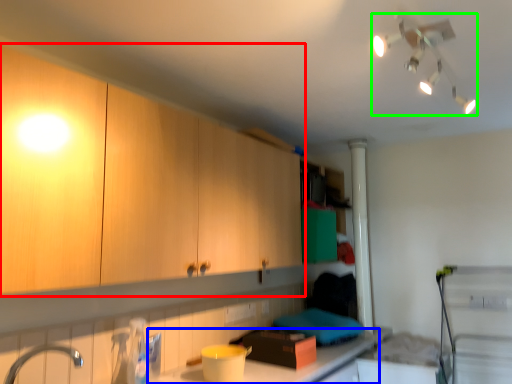
Question: Which object is the closest to the cabinetry (highlighted by a red box)? Choose among these: countertop (highlighted by a blue box) or light fixture (highlighted by a green box).

Choices:
 (A) countertop
 (B) light fixture

Answer: (A)